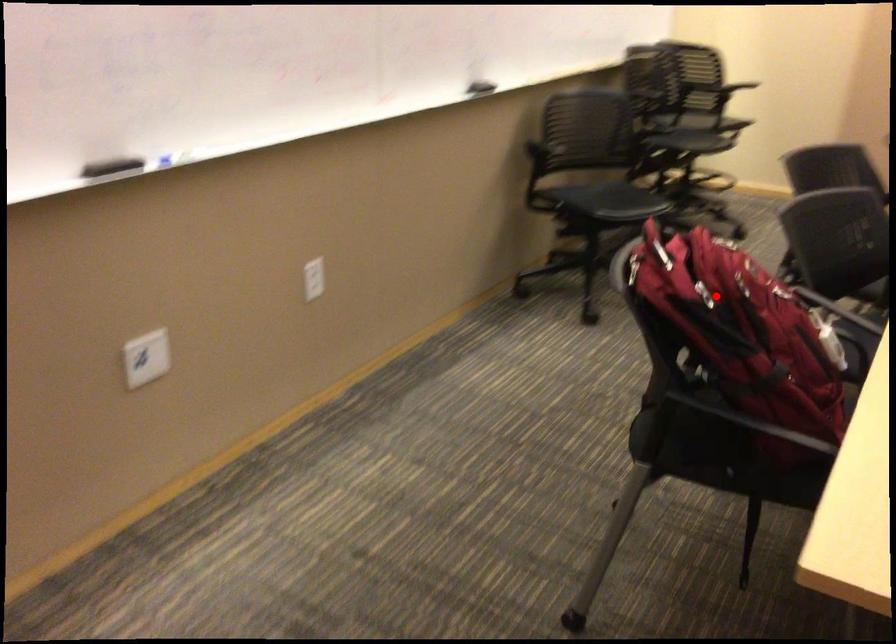
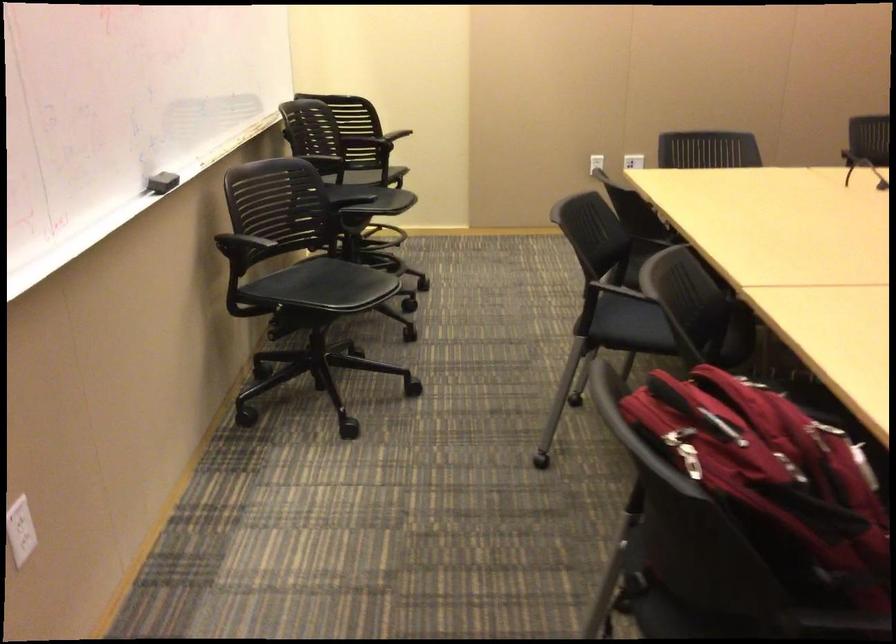
The point at the highlighted location is marked in the first image. Where is the corresponding point in the second image?

(773, 480)